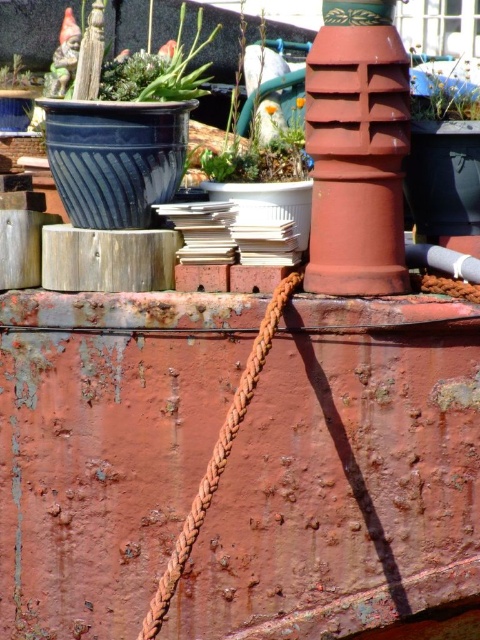
From the picture: You are a maintenance worker on a ship and need to reach the green matte plant at upper center. Given the coordinates provided, can you determine if it is positioned closer to the front or the back of the metal surface?

The green matte plant at upper center is located at point (x=269, y=120), which means it is closer to the front of the metal surface since the x and y coordinates are lower, indicating proximity to the origin point at the bottom left corner.

You are a maintenance worker on a ship and need to reach the green matte plant at upper center. Given the coordinates provided, is it positioned closer to the edge of the metal surface or the center?

The green matte plant at upper center is located at point [269,120], which means it is closer to the edge of the metal surface since the coordinates are closer to the edge than the center.

You are a gardener who needs to water both the green leafy plant at upper right and the green matte succulent at upper left. Your watering can has a maximum reach of 1.5 meters. Without moving the watering can, can you water both plants from your current position?

Result: The green leafy plant at upper right and the green matte succulent at upper left are 1.38 meters apart from each other. Since your watering can can reach up to 1.5 meters, you can water both plants without moving the watering can as the distance between them is within the reach.